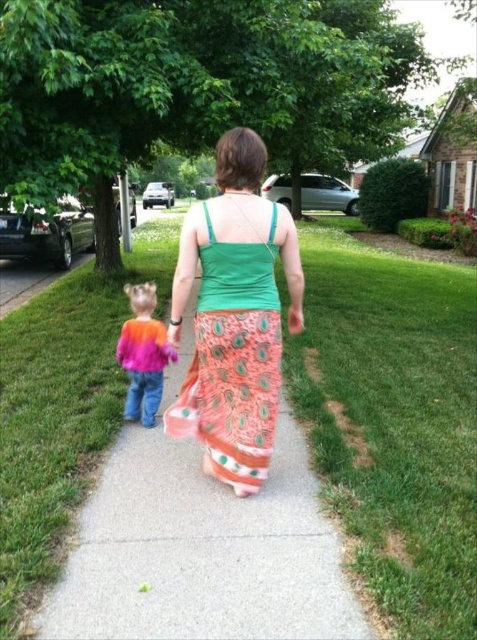
Question: Which point is farther from the camera taking this photo?

Choices:
 (A) pos(178,397)
 (B) pos(149,372)

Answer: (B)

Question: Can you confirm if orange peacock-patterned dress at center is positioned below multicolored knit sweater at center?

Choices:
 (A) yes
 (B) no

Answer: (B)

Question: Does orange peacock-patterned dress at center appear over multicolored knit sweater at center?

Choices:
 (A) no
 (B) yes

Answer: (B)

Question: Can you confirm if orange peacock-patterned dress at center is positioned below multicolored knit sweater at center?

Choices:
 (A) yes
 (B) no

Answer: (B)